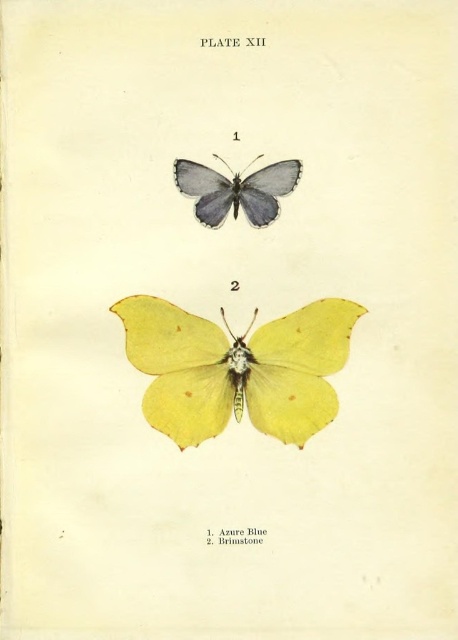
Consider the image. Which is above, matte yellow butterfly at lower center or matte azure blue butterfly at upper center?

matte azure blue butterfly at upper center is higher up.

Find the location of a particular element. Image resolution: width=458 pixels, height=640 pixels. matte yellow butterfly at lower center is located at coordinates (238, 369).

Where is `matte yellow butterfly at lower center`? The image size is (458, 640). matte yellow butterfly at lower center is located at coordinates (238, 369).